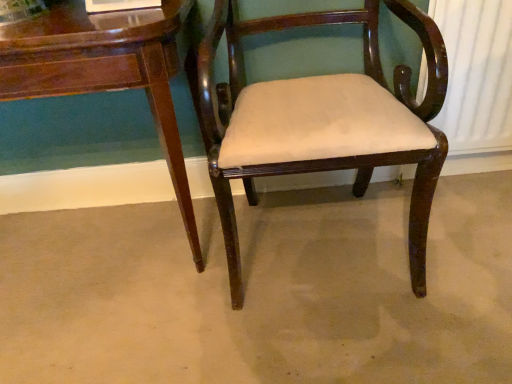
Identify the location of vacant area in front of glossy wood table at lower left. (100, 330).